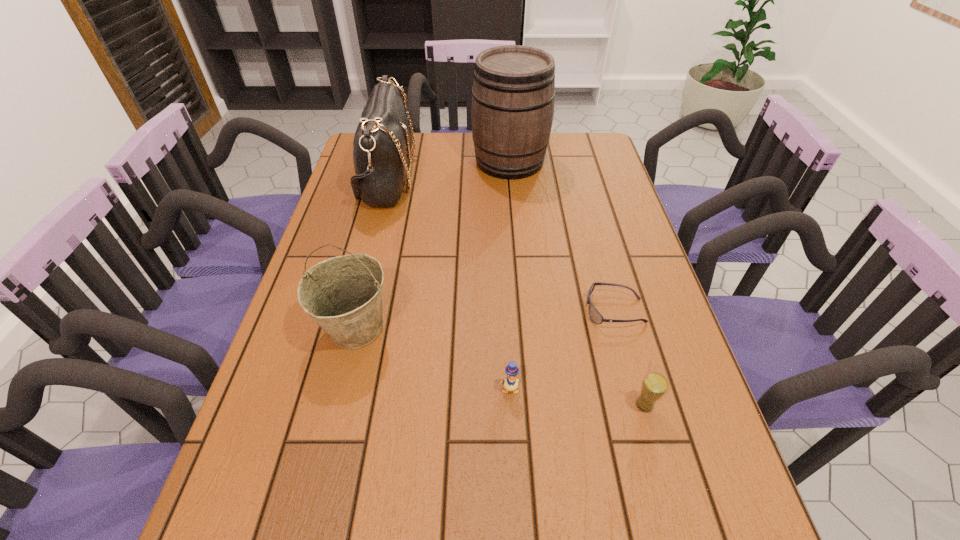
Image resolution: width=960 pixels, height=540 pixels. Find the location of `vacant area situated 0.260m on the back of the nearer wine bucket`. vacant area situated 0.260m on the back of the nearer wine bucket is located at coordinates (379, 231).

The height and width of the screenshot is (540, 960). I want to click on free region located 0.050m on the right of the straw for drinking, so click(680, 405).

At what (x,y) coordinates should I click in order to perform the action: click on blank space located on the face of the second shortest object, where the monocle is placed. Please return your answer as a coordinate pair (x, y). Image resolution: width=960 pixels, height=540 pixels. Looking at the image, I should click on (512, 437).

In order to click on free space located 0.070m on the lenses of the shortest object in this screenshot , I will do `click(558, 310)`.

Where is `vacant position located on the lenses of the shortest object`? vacant position located on the lenses of the shortest object is located at coordinates (510, 310).

The height and width of the screenshot is (540, 960). I want to click on vacant region located on the lenses of the shortest object, so click(x=466, y=310).

Identify the location of wine bucket located in the far edge section of the desktop. This screenshot has width=960, height=540. (513, 93).

The image size is (960, 540). Identify the location of handbag at the far edge. (382, 143).

The image size is (960, 540). Find the location of `handbag at the left edge`. handbag at the left edge is located at coordinates (382, 143).

The image size is (960, 540). What are the coordinates of `wine bucket located in the left edge section of the desktop` in the screenshot? It's located at (343, 295).